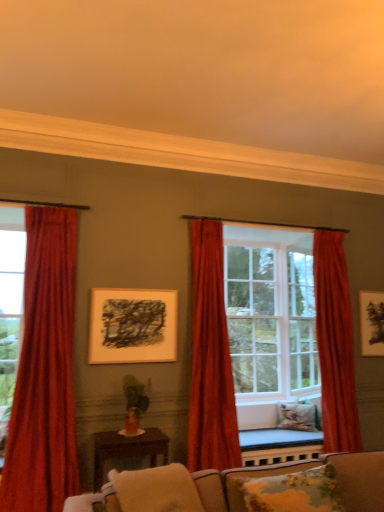
Question: Is brown wooden table at center not inside clear glass door at center, which appears as the 1th glass door when viewed from the right?

Choices:
 (A) no
 (B) yes

Answer: (B)

Question: Is brown wooden table at center bigger than clear glass door at center, marked as the second glass door in a front-to-back arrangement?

Choices:
 (A) no
 (B) yes

Answer: (B)

Question: Considering the relative sizes of brown wooden table at center and clear glass door at center, which appears as the 1th glass door when viewed from the right, in the image provided, is brown wooden table at center wider than clear glass door at center, which appears as the 1th glass door when viewed from the right,?

Choices:
 (A) no
 (B) yes

Answer: (B)

Question: Considering the relative sizes of brown wooden table at center and clear glass door at center, marked as the second glass door in a front-to-back arrangement, in the image provided, is brown wooden table at center shorter than clear glass door at center, marked as the second glass door in a front-to-back arrangement,?

Choices:
 (A) no
 (B) yes

Answer: (B)

Question: Is brown wooden table at center facing towards clear glass door at center, which appears as the 1th glass door when viewed from the right?

Choices:
 (A) yes
 (B) no

Answer: (B)

Question: Is matte black picture frame at upper right, which ranks as the second picture frame in left-to-right order, in front of or behind velvet red curtain at center, which is counted as the second curtain, starting from the left, in the image?

Choices:
 (A) front
 (B) behind

Answer: (B)

Question: In terms of width, does matte black picture frame at upper right, which appears as the first picture frame when viewed from the right, look wider or thinner when compared to velvet red curtain at center, positioned as the second curtain in right-to-left order?

Choices:
 (A) wide
 (B) thin

Answer: (B)

Question: Visually, is matte black picture frame at upper right, which appears as the first picture frame when viewed from the right, positioned to the left or to the right of velvet red curtain at center, which is counted as the second curtain, starting from the left?

Choices:
 (A) left
 (B) right

Answer: (B)

Question: Is matte black picture frame at upper right, which appears as the first picture frame when viewed from the right, inside the boundaries of velvet red curtain at center, which is counted as the second curtain, starting from the left, or outside?

Choices:
 (A) inside
 (B) outside

Answer: (B)

Question: From the image's perspective, is fluffy floral pillow at lower right, which ranks as the 2th pillow in right-to-left order, located above or below velvet red curtain at center, positioned as the second curtain in right-to-left order?

Choices:
 (A) above
 (B) below

Answer: (B)

Question: From a real-world perspective, is fluffy floral pillow at lower right, acting as the second pillow starting from the back, physically located above or below velvet red curtain at center, positioned as the second curtain in right-to-left order?

Choices:
 (A) above
 (B) below

Answer: (B)

Question: Considering the positions of fluffy floral pillow at lower right, which ranks as the 2th pillow in left-to-right order, and velvet red curtain at center, which is counted as the second curtain, starting from the left, in the image, is fluffy floral pillow at lower right, which ranks as the 2th pillow in left-to-right order, wider or thinner than velvet red curtain at center, which is counted as the second curtain, starting from the left,?

Choices:
 (A) thin
 (B) wide

Answer: (A)

Question: Do you think fluffy floral pillow at lower right, acting as the second pillow starting from the back, is within velvet red curtain at center, which is counted as the second curtain, starting from the left, or outside of it?

Choices:
 (A) outside
 (B) inside

Answer: (A)

Question: Is brown wooden table at center wider or thinner than clear glass door at center, which is the first glass door in back-to-front order?

Choices:
 (A) thin
 (B) wide

Answer: (B)

Question: Is point (94, 457) positioned closer to the camera than point (309, 285)?

Choices:
 (A) closer
 (B) farther

Answer: (A)